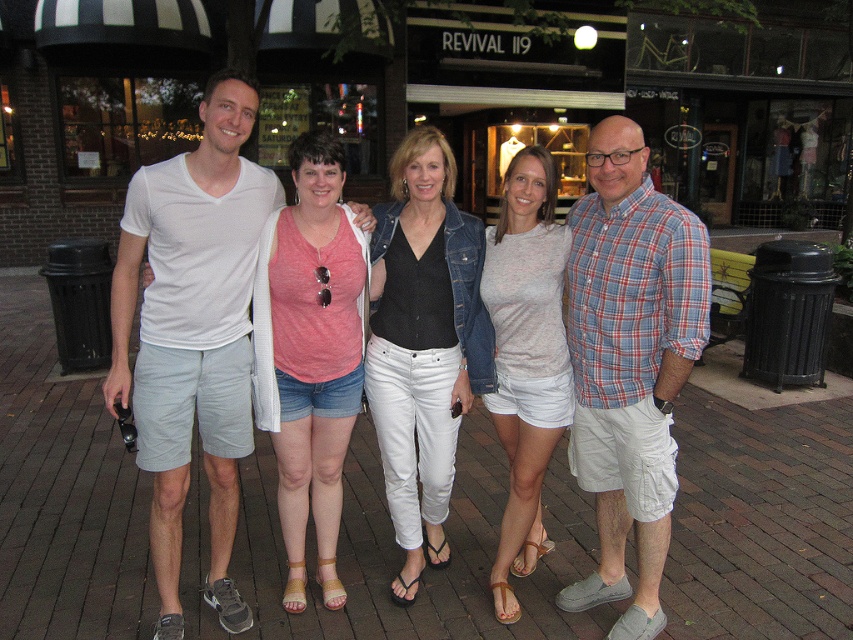
Question: Which of the following is the closest to the observer?

Choices:
 (A) light pink jersey at center
 (B) denim jacket at center

Answer: (A)

Question: Does white mesh t-shirt at left appear on the right side of plaid cotton shirt at right?

Choices:
 (A) yes
 (B) no

Answer: (B)

Question: Can you confirm if denim jacket at center is wider than pink fabric tank top at center?

Choices:
 (A) yes
 (B) no

Answer: (A)

Question: Which point appears closest to the camera in this image?

Choices:
 (A) (517, 307)
 (B) (300, 490)
 (C) (422, 364)
 (D) (206, 452)

Answer: (A)

Question: Does plaid cotton shirt at right have a greater width compared to light pink jersey at center?

Choices:
 (A) no
 (B) yes

Answer: (B)

Question: Estimate the real-world distances between objects in this image. Which object is closer to the light pink jersey at center?

Choices:
 (A) pink fabric tank top at center
 (B) denim jacket at center

Answer: (B)